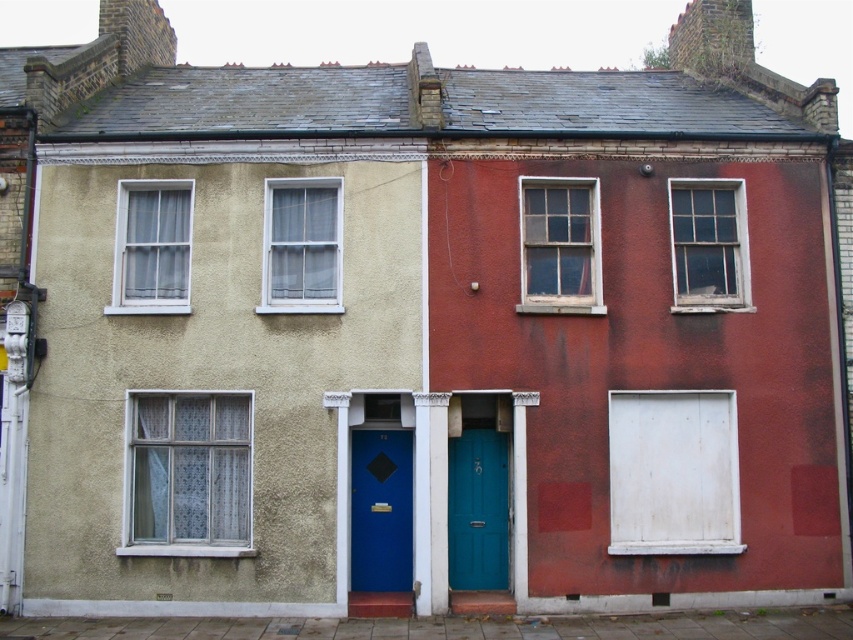
Who is higher up, white lace curtain at center or clear glass window at center?

clear glass window at center

Can you confirm if white lace curtain at center is positioned above clear glass window at center?

No, white lace curtain at center is not above clear glass window at center.

Between point (161, 426) and point (291, 198), which one is positioned in front?

Point (161, 426) is more forward.

The height and width of the screenshot is (640, 853). In order to click on white lace curtain at center in this screenshot , I will do `click(190, 468)`.

Does wooden frame window at center appear on the left side of clear glass window at center?

Incorrect, wooden frame window at center is not on the left side of clear glass window at center.

Can you confirm if wooden frame window at center is smaller than clear glass window at center?

No, wooden frame window at center is not smaller than clear glass window at center.

Is point (532, 200) behind point (309, 209)?

No, (532, 200) is in front of (309, 209).

Find the location of `wooden frame window at center`. wooden frame window at center is located at coordinates (560, 246).

What do you see at coordinates (190, 468) in the screenshot? I see `white lace curtain at center` at bounding box center [190, 468].

Can you confirm if white lace curtain at center is bigger than blue matte door at center?

Indeed, white lace curtain at center has a larger size compared to blue matte door at center.

Where is `white lace curtain at center`? The image size is (853, 640). white lace curtain at center is located at coordinates (190, 468).